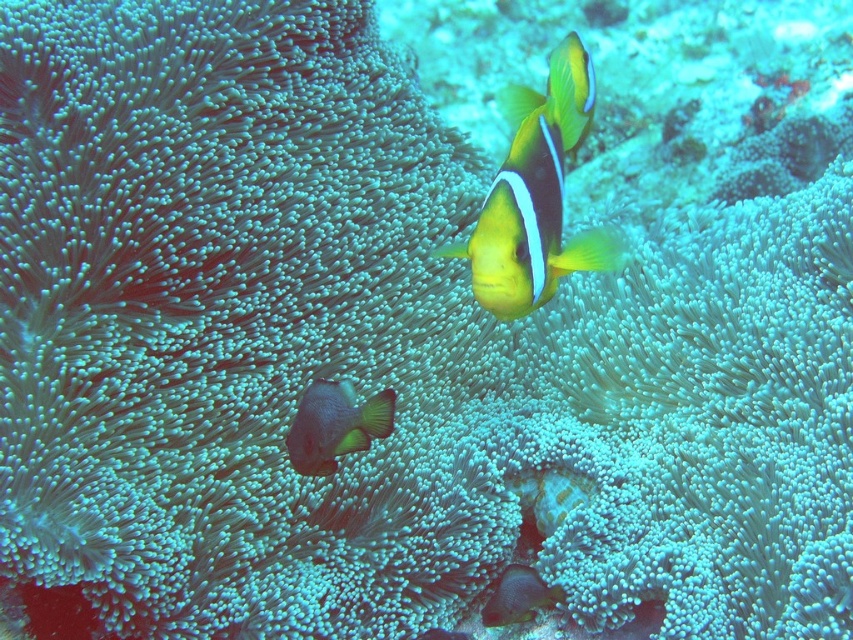
You are a marine biologist observing the underwater scene. You notice the yellow matte clownfish at center and the matte gray fish at center. Which fish is positioned to the right side of the other?

The yellow matte clownfish at center is to the right of the matte gray fish at center.

You are a marine biologist observing the underwater scene. You need to determine the exact position of the yellow matte clownfish at center relative to the anemones. Based on the coordinates provided, can you confirm if the fish is positioned to the left or right of the anemones?

The yellow matte clownfish at center is located at point (537, 195). Since the coordinates are given without reference to the anemones, it is impossible to determine its position relative to the anemones without additional spatial information.

You are an underwater photographer aiming to capture the yellow matte clownfish at center and the matte gray fish at center in a single shot. Based on their sizes, which fish should you focus on first to ensure both fit in the frame?

The yellow matte clownfish at center is taller than the matte gray fish at center, so focusing on the yellow matte clownfish at center first will help ensure both fit in the frame by accounting for its larger size.